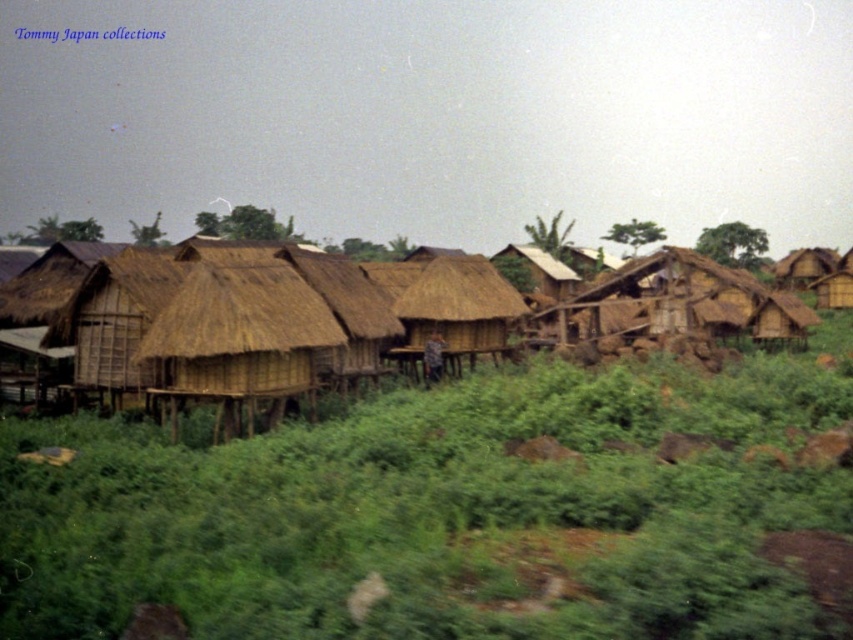
You are a traveler standing in the rural settlement and want to find the taller structure between the brown thatch hut at right and the thatched straw hut at center. Which one should you look towards?

The thatched straw hut at center is taller than the brown thatch hut at right, so you should look towards the thatched straw hut at center.

You are standing in the rural settlement and want to move from the thatched straw hut at center to the brown thatch hut at right. Which direction should you go?

You should go to the right to reach the brown thatch hut at right from the thatched straw hut at center.